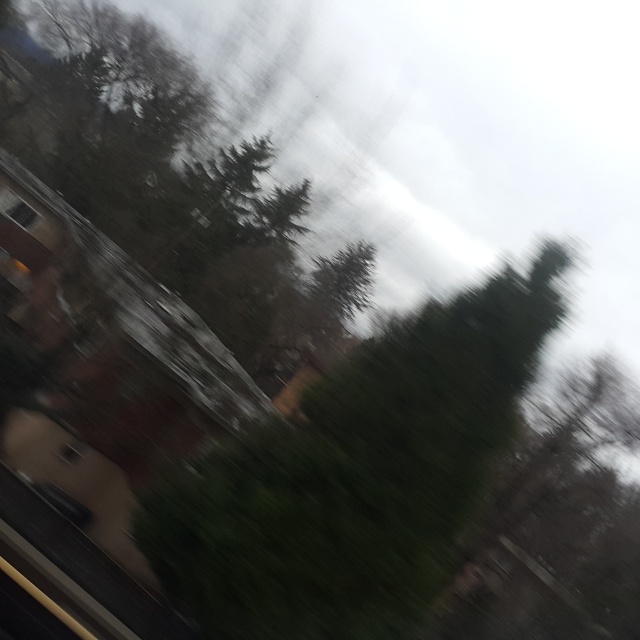
Does green leafy tree at center have a lesser height compared to green leafy tree at upper left?

Yes, green leafy tree at center is shorter than green leafy tree at upper left.

Is green leafy tree at center to the right of green leafy tree at upper left from the viewer's perspective?

Correct, you'll find green leafy tree at center to the right of green leafy tree at upper left.

You are a GUI agent. You are given a task and a screenshot of the screen. Output one action in this format:
    pyautogui.click(x=<x>, y=<y>)
    Task: Click on the green leafy tree at center
    
    Given the screenshot: What is the action you would take?
    pyautogui.click(x=356, y=474)

Where is `green leafy tree at center`? green leafy tree at center is located at coordinates (356, 474).

Is green leafy tree at upper left taller than transparent glass window at upper left?

Yes.

Who is more distant from viewer, (186, 196) or (12, 205)?

The point (186, 196) is behind.

Image resolution: width=640 pixels, height=640 pixels. In order to click on green leafy tree at upper left in this screenshot , I will do `click(172, 177)`.

Which is more to the right, green leafy tree at center or transparent glass window at upper left?

green leafy tree at center is more to the right.

You are a GUI agent. You are given a task and a screenshot of the screen. Output one action in this format:
    pyautogui.click(x=<x>, y=<y>)
    Task: Click on the green leafy tree at center
    
    Given the screenshot: What is the action you would take?
    pyautogui.click(x=356, y=474)